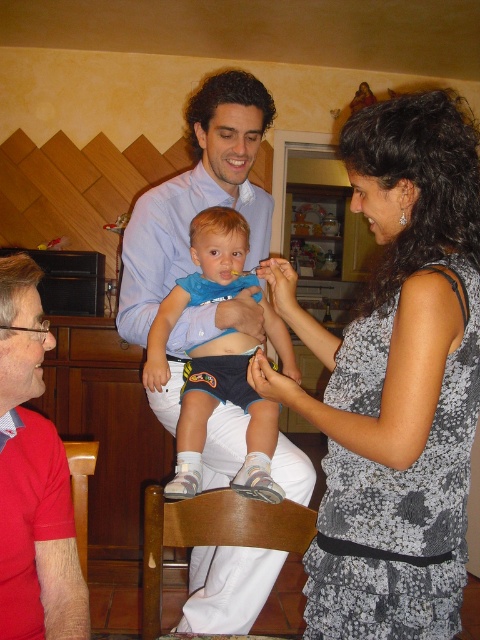
Question: Is floral dress at center further to the viewer compared to matte blue shorts at center?

Choices:
 (A) no
 (B) yes

Answer: (A)

Question: Which object is closer to the camera taking this photo?

Choices:
 (A) red cotton shirt at left
 (B) wooden chair at lower center
 (C) matte blue shorts at center
 (D) floral dress at center

Answer: (D)

Question: Which of the following is the farthest from the observer?

Choices:
 (A) red cotton shirt at left
 (B) wooden chair at lower center
 (C) matte blue shorts at center

Answer: (C)

Question: Estimate the real-world distances between objects in this image. Which object is farther from the wooden chair at lower left?

Choices:
 (A) floral dress at center
 (B) wooden chair at lower center
 (C) matte blue shorts at center
 (D) red cotton shirt at left

Answer: (A)

Question: In this image, where is floral dress at center located relative to red cotton shirt at left?

Choices:
 (A) above
 (B) below

Answer: (A)

Question: Can you confirm if matte blue shorts at center is bigger than wooden chair at lower center?

Choices:
 (A) yes
 (B) no

Answer: (A)